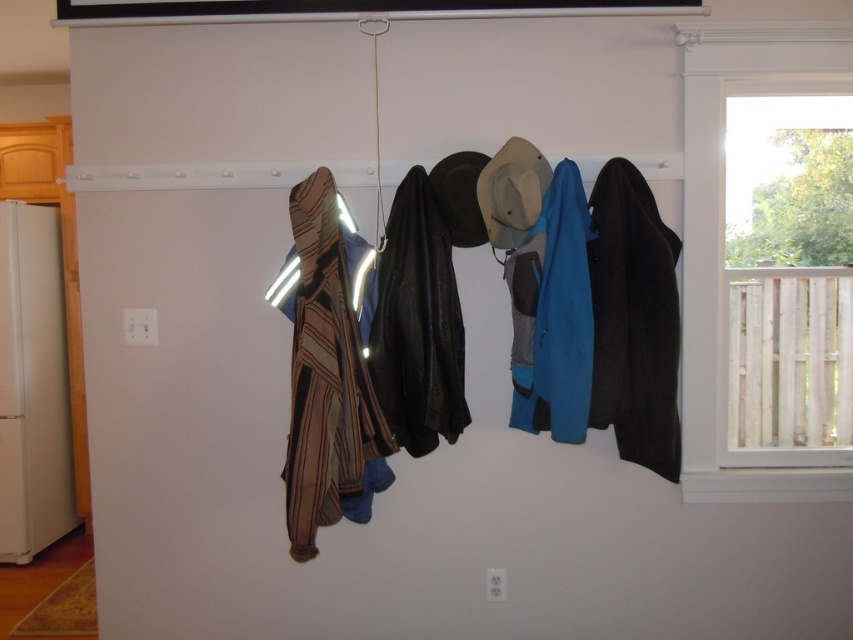
Question: Based on their relative distances, which object is nearer to the striped fabric scarf at left?

Choices:
 (A) leather jacket at center
 (B) white matte refrigerator at left
 (C) teal fleece jacket at center
 (D) light beige felt hat at center

Answer: (A)

Question: Is white matte refrigerator at left positioned behind teal fleece jacket at center?

Choices:
 (A) no
 (B) yes

Answer: (B)

Question: Observing the image, what is the correct spatial positioning of black wool coat at right in reference to white matte refrigerator at left?

Choices:
 (A) below
 (B) above

Answer: (B)

Question: Which object is positioned closest to the light beige felt hat at center?

Choices:
 (A) striped fabric scarf at left
 (B) white matte refrigerator at left
 (C) black wool coat at right
 (D) teal fleece jacket at center

Answer: (D)

Question: Which object is the closest to the teal fleece jacket at center?

Choices:
 (A) striped fabric scarf at left
 (B) black wool coat at right
 (C) white matte refrigerator at left

Answer: (B)

Question: Does striped fabric scarf at left lie in front of leather jacket at center?

Choices:
 (A) no
 (B) yes

Answer: (B)